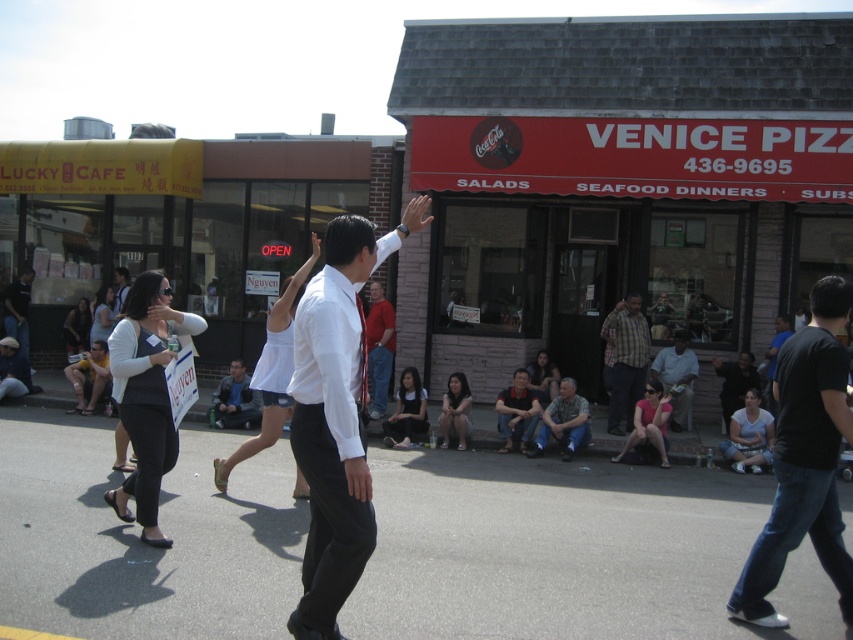
Question: Which is nearer to the camouflage fabric shirt at lower center?

Choices:
 (A) white glossy shirt at center
 (B) dark blue jeans at lower left
 (C) dark blue jacket at center

Answer: (C)

Question: Which object is closer to the camera taking this photo?

Choices:
 (A) plaid fabric shirt at center
 (B) dark blue jeans at lower left

Answer: (A)

Question: Can you confirm if red brick storefront at center is positioned below dark blue jeans at lower left?

Choices:
 (A) no
 (B) yes

Answer: (B)

Question: Does dark blue jacket at center lie behind dark gray pants at lower center?

Choices:
 (A) yes
 (B) no

Answer: (A)

Question: Which of the following is the farthest from the observer?

Choices:
 (A) (440, 404)
 (B) (550, 428)

Answer: (A)

Question: Can you confirm if red cotton shirt at center is wider than dark blue jacket at center?

Choices:
 (A) no
 (B) yes

Answer: (A)